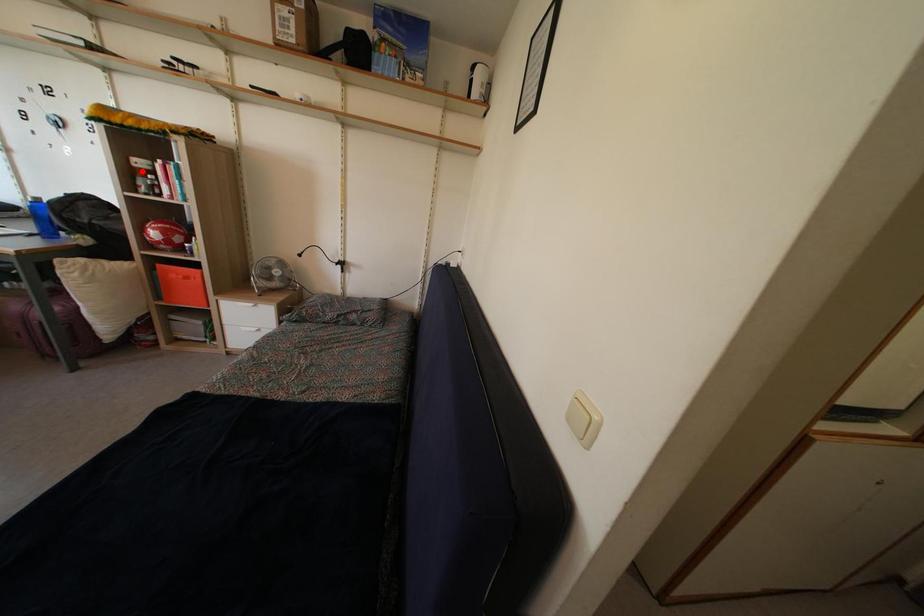
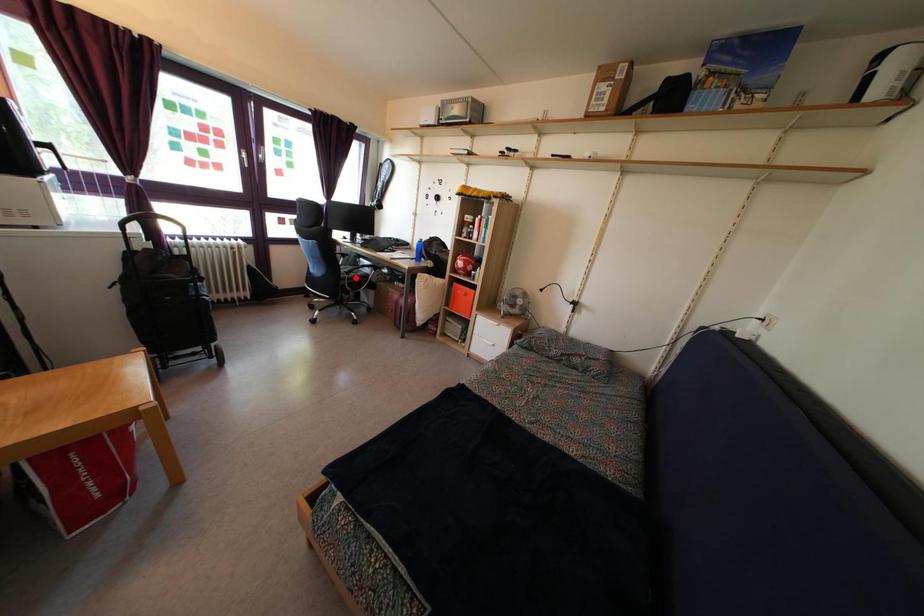
I am providing you with two images of the same scene from different viewpoints. A red point is marked on the first image and another point is marked on the second image. Is the red point in image1 aligned with the point shown in image2?

No